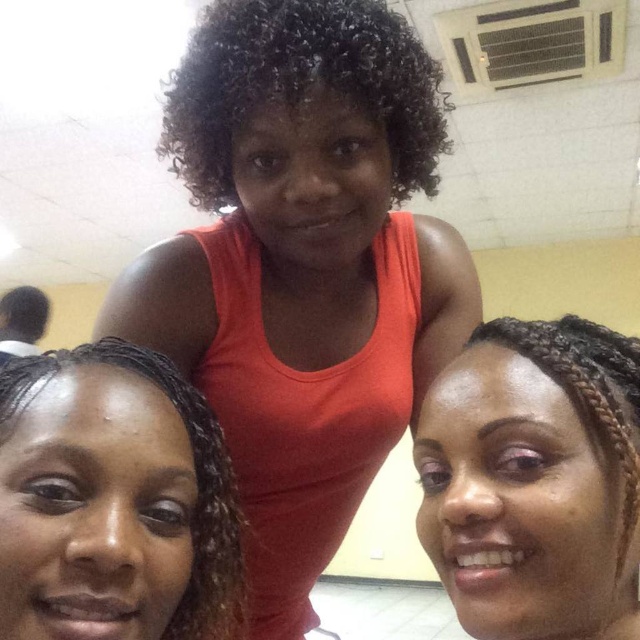
You are taking a selfie with three friends indoors. You notice the curly dark brown hair at center. Where is it positioned relative to the other two individuals?

The curly dark brown hair at center is located at point (x=300, y=84), which places it centrally among the three individuals, between the person on the left with braided hair and the one on the right with light braided hair.

You are taking a selfie with two friends. You notice the curly dark brown hair at center and the black braided hair at lower right. Which hairstyle is covering the other?

The curly dark brown hair at center is positioned over the black braided hair at lower right, so it is covering it.